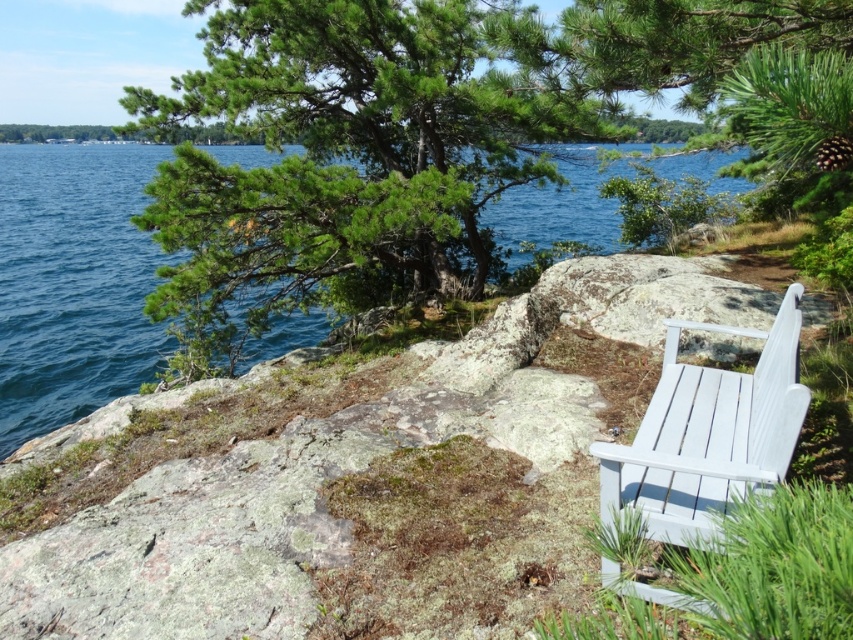
Question: Does white wood bench at right appear over white painted wood bench at right?

Choices:
 (A) yes
 (B) no

Answer: (B)

Question: Does white wood bench at right have a smaller size compared to white painted wood bench at right?

Choices:
 (A) no
 (B) yes

Answer: (A)

Question: Which point is closer to the camera?

Choices:
 (A) white wood bench at right
 (B) blue water at upper left

Answer: (A)

Question: Which object appears closest to the camera in this image?

Choices:
 (A) white painted wood bench at right
 (B) blue water at upper left

Answer: (A)

Question: Can you confirm if blue water at upper left is bigger than white painted wood bench at right?

Choices:
 (A) no
 (B) yes

Answer: (B)

Question: Which object is the farthest from the white painted wood bench at right?

Choices:
 (A) blue water at upper left
 (B) white wood bench at right

Answer: (A)